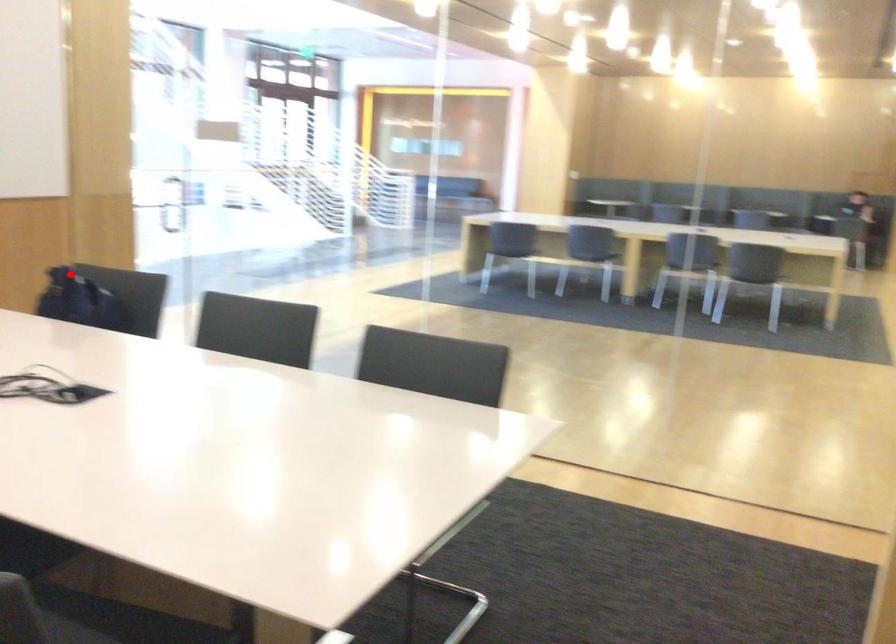
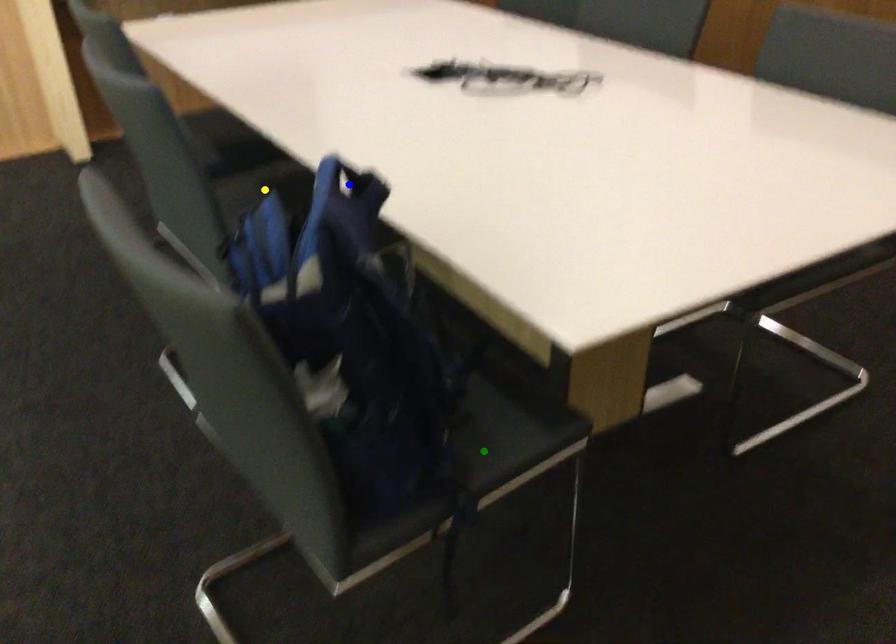
Question: I am providing you with two images of the same scene from different viewpoints. A red point is marked on the first image. You are given multiple points on the second image. Can you choose the point in image 2 that corresponds to the point in image 1?

Choices:
 (A) yellow point
 (B) blue point
 (C) green point

Answer: (B)